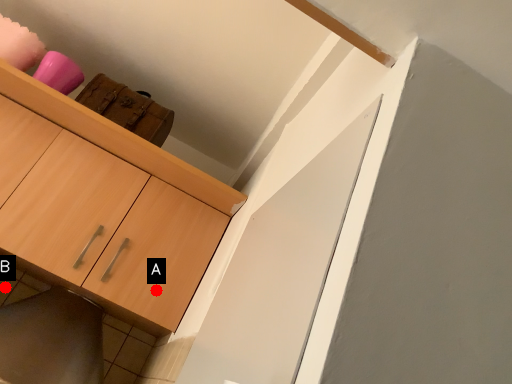
Question: Two points are circled on the image, labeled by A and B beside each circle. Which point appears closest to the camera in this image?

Choices:
 (A) A is closer
 (B) B is closer

Answer: (A)